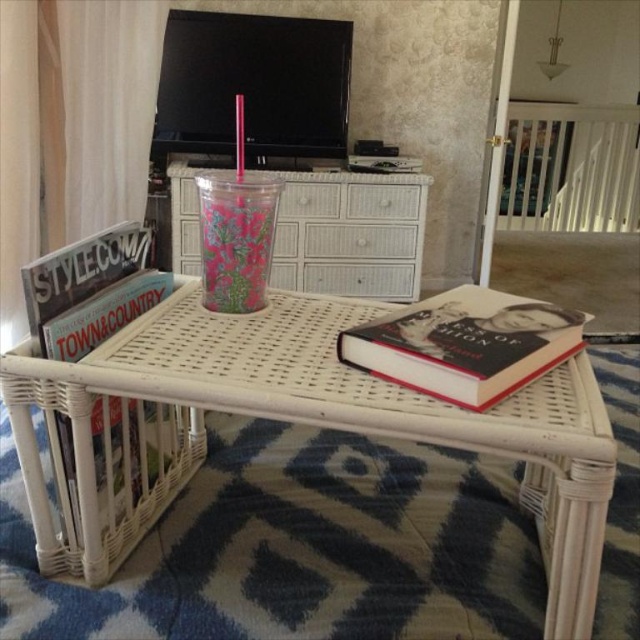
Question: Which point is closer to the camera?

Choices:
 (A) hardcover book at center
 (B) translucent floral-patterned cup at center

Answer: (A)

Question: Which object is positioned farthest from the white wicker table at center?

Choices:
 (A) matte black magazine at left
 (B) hardcover book at center
 (C) translucent floral-patterned cup at center

Answer: (A)

Question: Is white wicker table at center positioned in front of translucent floral-patterned cup at center?

Choices:
 (A) no
 (B) yes

Answer: (B)

Question: Which of the following is the closest to the observer?

Choices:
 (A) translucent floral-patterned cup at center
 (B) white wicker table at center

Answer: (B)

Question: Observing the image, what is the correct spatial positioning of hardcover book at center in reference to matte black magazine at left?

Choices:
 (A) right
 (B) left

Answer: (A)

Question: Can you confirm if hardcover book at center is wider than translucent floral-patterned cup at center?

Choices:
 (A) yes
 (B) no

Answer: (A)